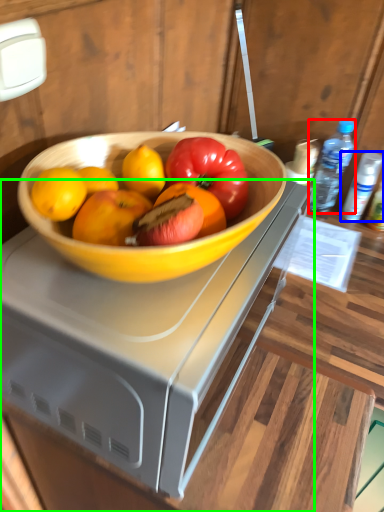
Question: Which object is positioned closest to bottle (highlighted by a red box)? Select from bottle (highlighted by a blue box) and desk (highlighted by a green box).

Choices:
 (A) bottle
 (B) desk

Answer: (A)